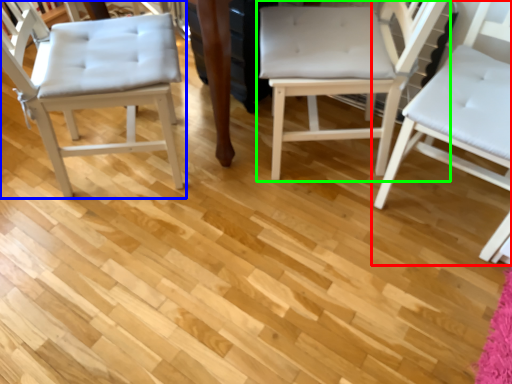
Question: Estimate the real-world distances between objects in this image. Which object is closer to chair (highlighted by a red box), chair (highlighted by a blue box) or chair (highlighted by a green box)?

Choices:
 (A) chair
 (B) chair

Answer: (B)